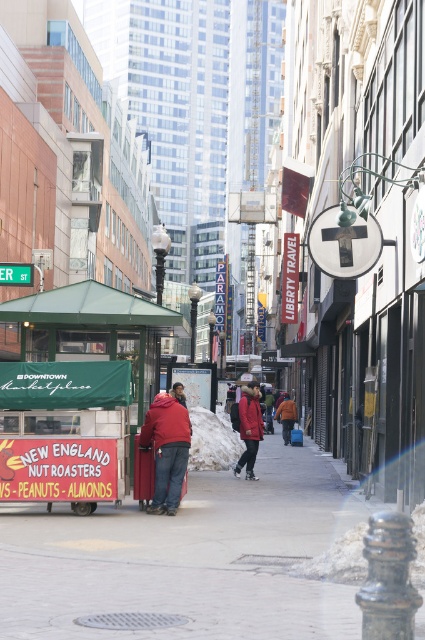
Can you confirm if red jacket at center is positioned above orange fuzzy jacket at center?

Yes.

Which is in front, point (159, 502) or point (282, 410)?

Point (159, 502)

Is point (180, 442) closer to camera compared to point (289, 428)?

Yes, it is.

Identify the location of red jacket at center. (167, 449).

Can you confirm if green fabric cart at center is wider than red jacket at center?

Incorrect, green fabric cart at center's width does not surpass red jacket at center's.

The width and height of the screenshot is (425, 640). Identify the location of green fabric cart at center. (85, 364).

Who is positioned more to the left, red jacket at center or red wool coat at center?

red jacket at center is more to the left.

Does point (155, 499) come behind point (252, 454)?

No.

Describe the element at coordinates (167, 449) in the screenshot. I see `red jacket at center` at that location.

Identify the location of red jacket at center. This screenshot has width=425, height=640. (167, 449).